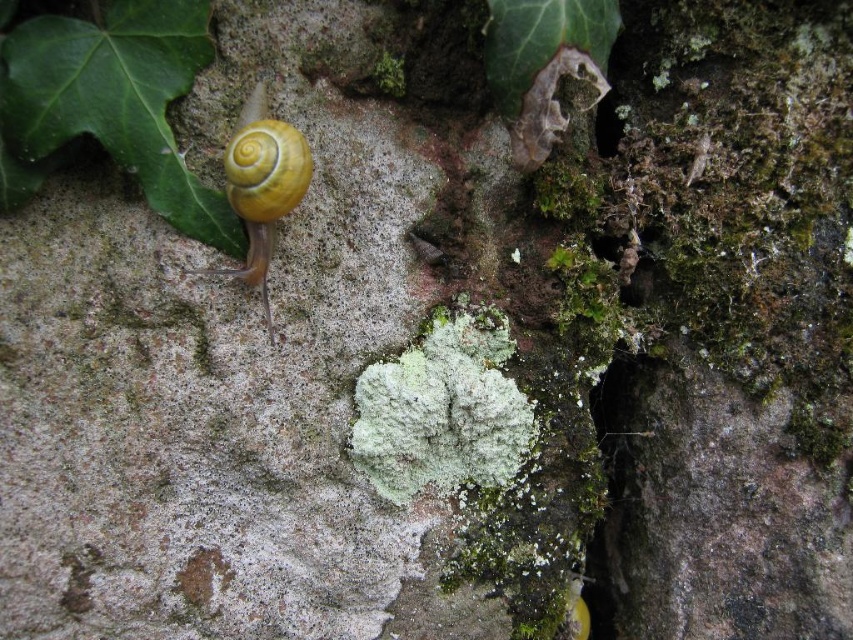
You are an insect on the textured surface and want to reach the green matte leaf at upper left. Which direction should you move from your current position at point (120, 99)?

The point (120, 99) is already the location of the green matte leaf at upper left, so you are already there.

You are an insect trying to cross from the yellow shiny snail at upper left to the green matte leaf at upper left. Which direction should you move to reach the leaf from the snail?

The green matte leaf at upper left is located to the left of the yellow shiny snail at upper left. Move towards the left to reach the leaf from the snail.